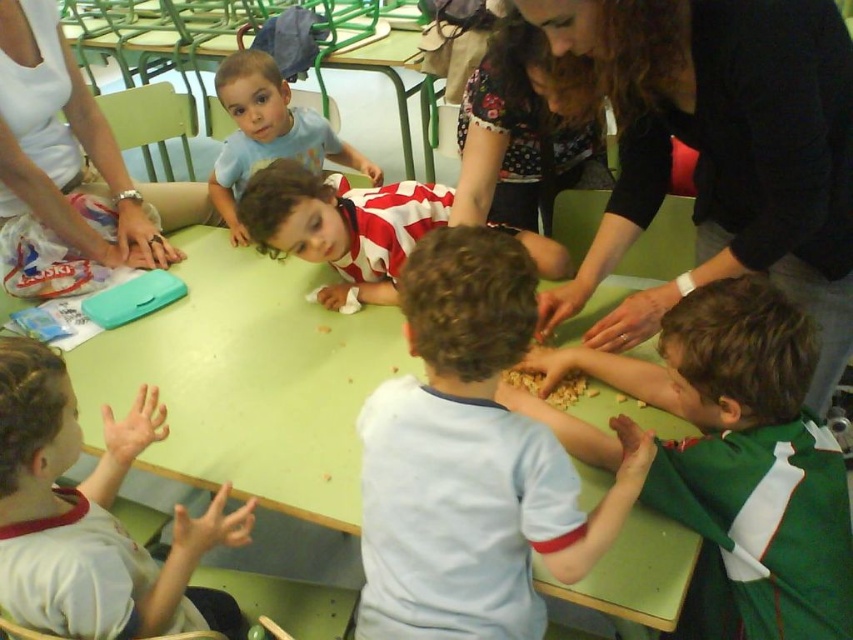
Question: Which object appears farthest from the camera in this image?

Choices:
 (A) green jersey at center
 (B) light gray shirt at lower left
 (C) striped jersey at center
 (D) dark blue sweater at upper right

Answer: (C)

Question: Can you confirm if green matte table at center is wider than green jersey at center?

Choices:
 (A) no
 (B) yes

Answer: (B)

Question: Does white cotton shirt at center appear under matte blue shirt at upper left?

Choices:
 (A) no
 (B) yes

Answer: (B)

Question: Does green matte table at center have a lesser width compared to green jersey at center?

Choices:
 (A) no
 (B) yes

Answer: (A)

Question: Which object is positioned closest to the green matte table at center?

Choices:
 (A) green jersey at center
 (B) white cotton shirt at center

Answer: (B)

Question: Which of the following is the farthest from the observer?

Choices:
 (A) (242, 84)
 (B) (785, 106)

Answer: (A)